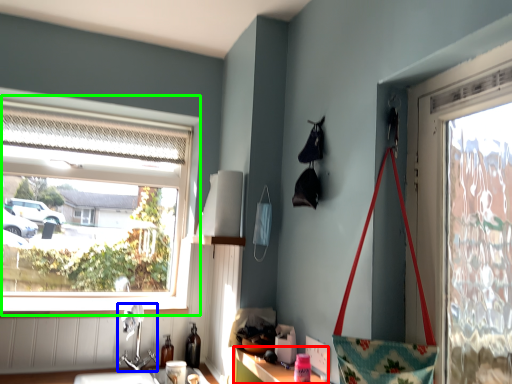
Question: Which object is positioned closest to cabinetry (highlighted by a red box)? Select from faucet (highlighted by a blue box) and window (highlighted by a green box).

Choices:
 (A) faucet
 (B) window

Answer: (A)